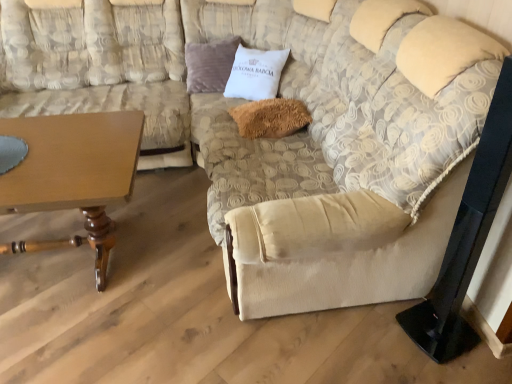
Question: Does velvet purple pillow at upper center, the first pillow from the left, have a smaller size compared to fuzzy brown pillow at center, the 2th pillow viewed from the left?

Choices:
 (A) yes
 (B) no

Answer: (B)

Question: Is velvet purple pillow at upper center, the first pillow from the left, not within fuzzy brown pillow at center, which ranks as the 1th pillow in bottom-to-top order?

Choices:
 (A) no
 (B) yes

Answer: (B)

Question: From a real-world perspective, is velvet purple pillow at upper center, which ranks as the 2th pillow in front-to-back order, physically above fuzzy brown pillow at center, which is the first pillow in right-to-left order?

Choices:
 (A) no
 (B) yes

Answer: (B)

Question: Does velvet purple pillow at upper center, which ranks as the second pillow in right-to-left order, come behind fuzzy brown pillow at center, placed as the 1th pillow when sorted from front to back?

Choices:
 (A) yes
 (B) no

Answer: (A)

Question: Does velvet purple pillow at upper center, arranged as the second pillow when ordered from the bottom, have a lesser height compared to fuzzy brown pillow at center, which is counted as the second pillow, starting from the back?

Choices:
 (A) no
 (B) yes

Answer: (A)

Question: From a real-world perspective, is velvet purple pillow at upper center, which ranks as the 2th pillow in front-to-back order, positioned above or below beige fabric couch at left?

Choices:
 (A) above
 (B) below

Answer: (B)

Question: Considering the positions of velvet purple pillow at upper center, the first pillow from the left, and beige fabric couch at left in the image, is velvet purple pillow at upper center, the first pillow from the left, wider or thinner than beige fabric couch at left?

Choices:
 (A) thin
 (B) wide

Answer: (A)

Question: From the image's perspective, is velvet purple pillow at upper center, which is the 1th pillow from back to front, located above or below beige fabric couch at left?

Choices:
 (A) below
 (B) above

Answer: (B)

Question: Based on their sizes in the image, would you say velvet purple pillow at upper center, which is the first pillow from top to bottom, is bigger or smaller than beige fabric couch at left?

Choices:
 (A) big
 (B) small

Answer: (B)

Question: Considering the positions of point (56, 173) and point (159, 64), is point (56, 173) closer or farther from the camera than point (159, 64)?

Choices:
 (A) closer
 (B) farther

Answer: (A)

Question: In terms of size, does wooden table at lower left appear bigger or smaller than beige fabric couch at left?

Choices:
 (A) small
 (B) big

Answer: (A)

Question: Based on their positions, is wooden table at lower left located to the left or right of beige fabric couch at left?

Choices:
 (A) right
 (B) left

Answer: (A)

Question: Is wooden table at lower left in front of or behind beige fabric couch at left in the image?

Choices:
 (A) behind
 (B) front

Answer: (B)

Question: In the image, is velvet purple pillow at upper center, which ranks as the second pillow in right-to-left order, positioned in front of or behind wooden table at lower left?

Choices:
 (A) front
 (B) behind

Answer: (B)

Question: Is velvet purple pillow at upper center, which ranks as the second pillow in right-to-left order, inside or outside of wooden table at lower left?

Choices:
 (A) outside
 (B) inside

Answer: (A)